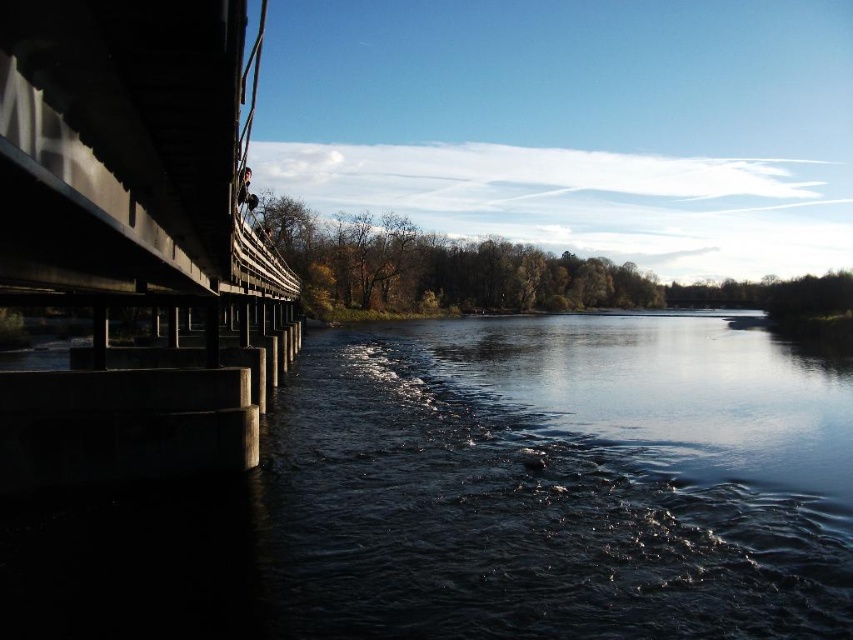
The height and width of the screenshot is (640, 853). Identify the location of dark concrete water at lower left. (485, 497).

Does dark concrete water at lower left appear under concrete bridge at left?

Yes.

Is point (419, 448) positioned in front of point (227, 134)?

That is False.

Where is `dark concrete water at lower left`? dark concrete water at lower left is located at coordinates (485, 497).